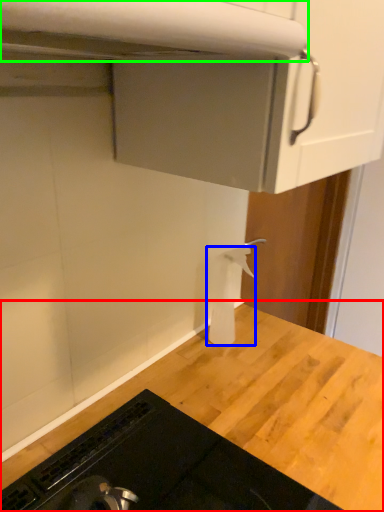
Question: Based on their relative distances, which object is nearer to countertop (highlighted by a red box)? Choose from toilet paper (highlighted by a blue box) and exhaust hood (highlighted by a green box).

Choices:
 (A) toilet paper
 (B) exhaust hood

Answer: (A)